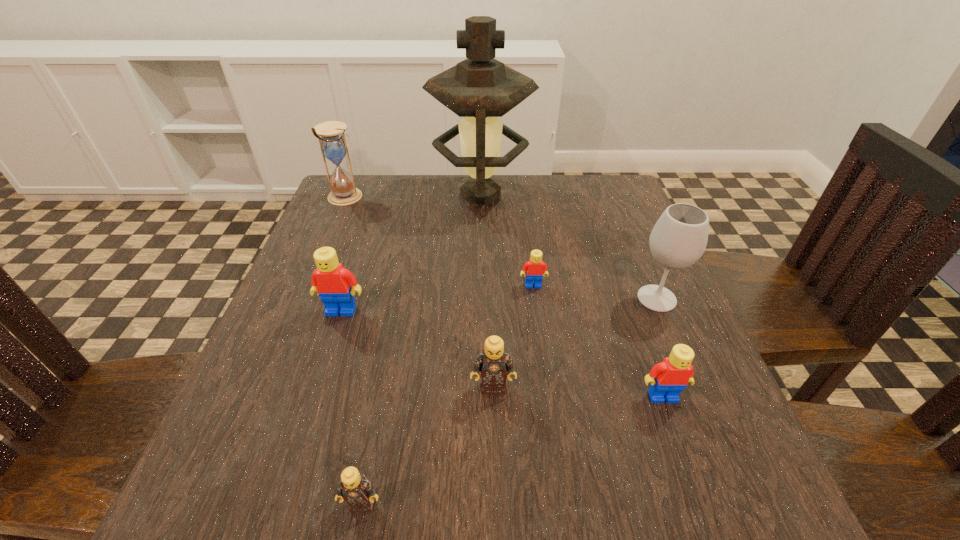
The height and width of the screenshot is (540, 960). In the image, there is a desktop. Identify the location of vacant space at the left edge. (380, 236).

Where is `vacant position at the right edge of the desktop`? This screenshot has height=540, width=960. vacant position at the right edge of the desktop is located at coordinates (597, 259).

Identify the location of free space at the far left corner. (386, 207).

Locate an element on the screen. free region at the near left corner is located at coordinates (224, 492).

Locate an element on the screen. The height and width of the screenshot is (540, 960). free space at the far right corner of the desktop is located at coordinates (580, 209).

Locate an element on the screen. The height and width of the screenshot is (540, 960). free space between the second red Lego from left to right and the oil lamp is located at coordinates (507, 240).

At what (x,y) coordinates should I click in order to perform the action: click on empty location between the white hourglass and the fifth shortest object. Please return your answer as a coordinate pair (x, y). The height and width of the screenshot is (540, 960). Looking at the image, I should click on (343, 254).

Find the location of `free spot between the farthest Lego and the wineglass`. free spot between the farthest Lego and the wineglass is located at coordinates (595, 292).

At what (x,y) coordinates should I click in order to perform the action: click on free point between the tallest object and the bigger tan Lego. Please return your answer as a coordinate pair (x, y). The width and height of the screenshot is (960, 540). Looking at the image, I should click on (487, 291).

This screenshot has width=960, height=540. I want to click on unoccupied position between the tallest object and the wineglass, so click(568, 247).